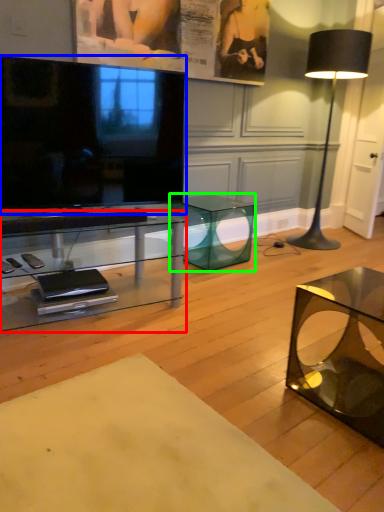
Question: Which object is the farthest from table (highlighted by a red box)? Choose among these: television (highlighted by a blue box) or table (highlighted by a green box).

Choices:
 (A) television
 (B) table

Answer: (B)